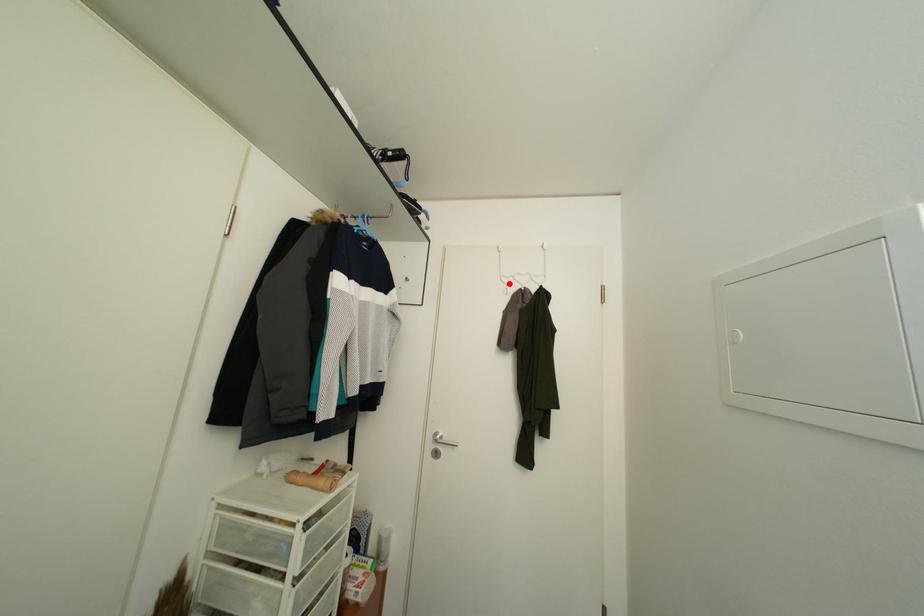
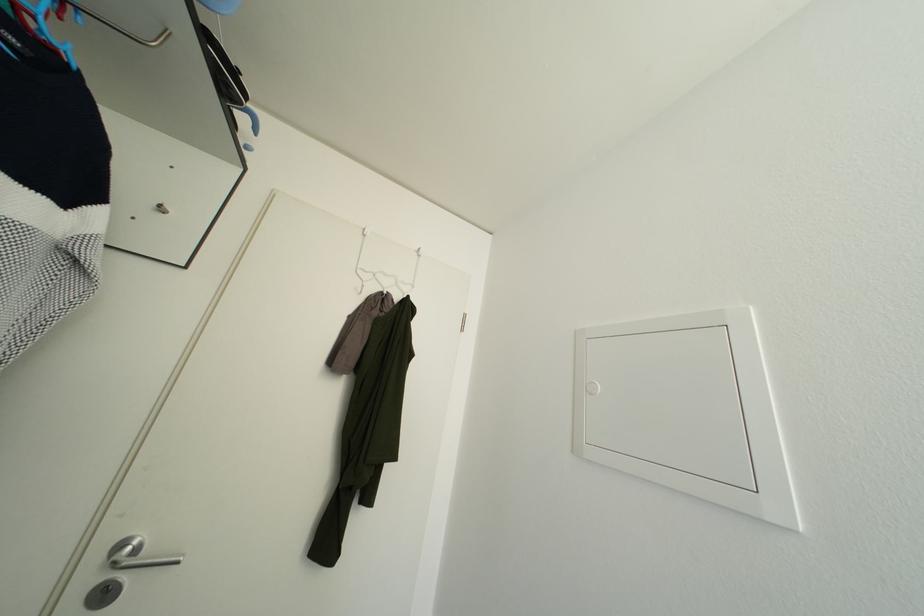
The point at the highlighted location is marked in the first image. Where is the corresponding point in the second image?

(366, 277)